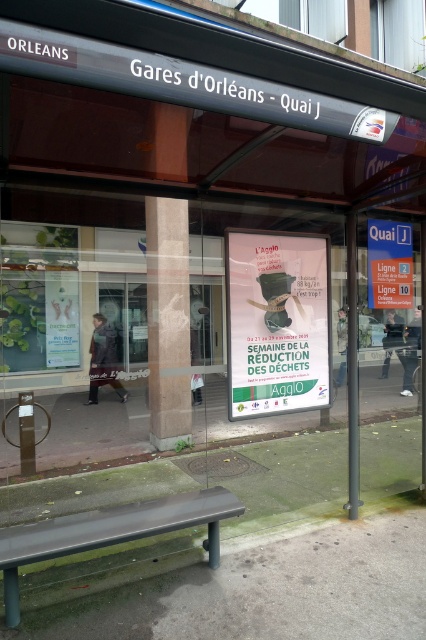
Question: Which point is farther to the camera?

Choices:
 (A) black plastic bench at lower center
 (B) white paper sign at center
 (C) white paper poster at center

Answer: (B)

Question: Which point appears farthest from the camera in this image?

Choices:
 (A) (199, 516)
 (B) (411, 253)
 (C) (273, 243)

Answer: (B)

Question: Is black plastic bench at lower center further to the viewer compared to white paper sign at center?

Choices:
 (A) yes
 (B) no

Answer: (B)

Question: Based on their relative distances, which object is nearer to the white paper poster at center?

Choices:
 (A) black plastic bench at lower center
 (B) white paper sign at center

Answer: (B)

Question: Is white paper poster at center in front of black plastic bench at lower center?

Choices:
 (A) no
 (B) yes

Answer: (A)

Question: Does black plastic bench at lower center have a smaller size compared to white paper sign at center?

Choices:
 (A) yes
 (B) no

Answer: (B)